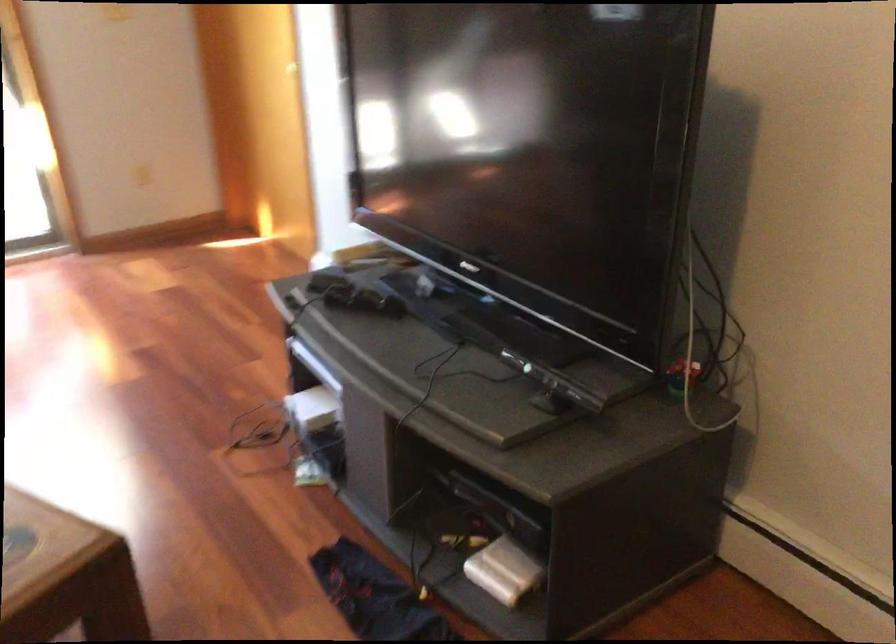
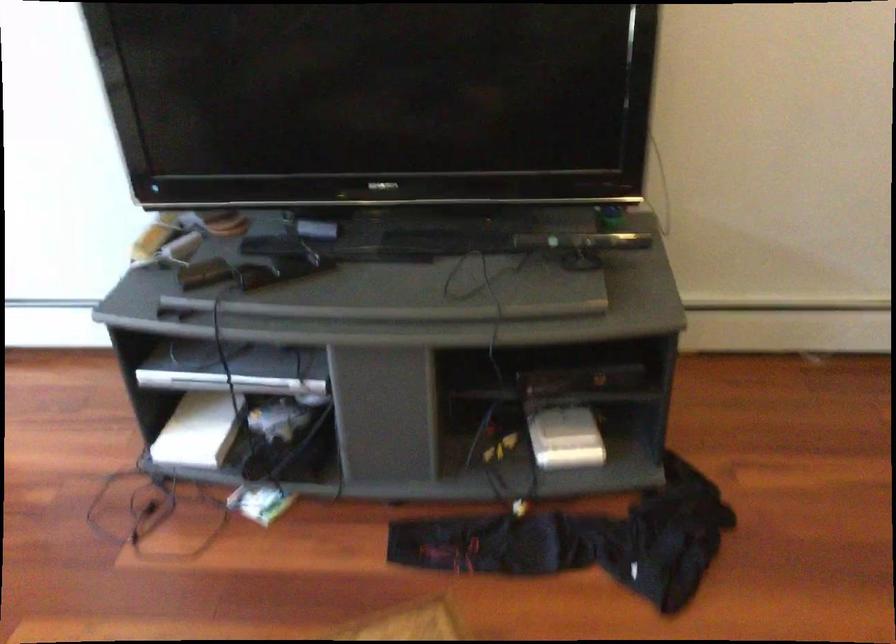
Locate, in the second image, the point that corresponds to point 314,399 in the first image.

(199, 430)